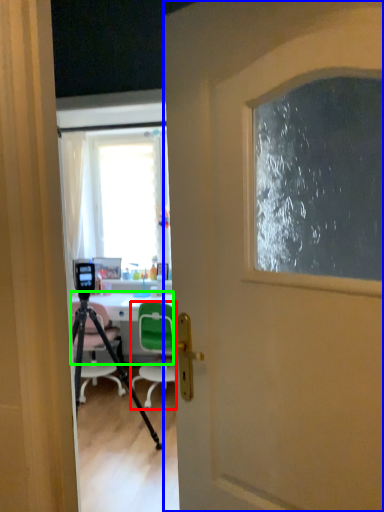
Question: Which object is the farthest from chair (highlighted by a red box)? Choose among these: door (highlighted by a blue box) or desk (highlighted by a green box).

Choices:
 (A) door
 (B) desk

Answer: (A)